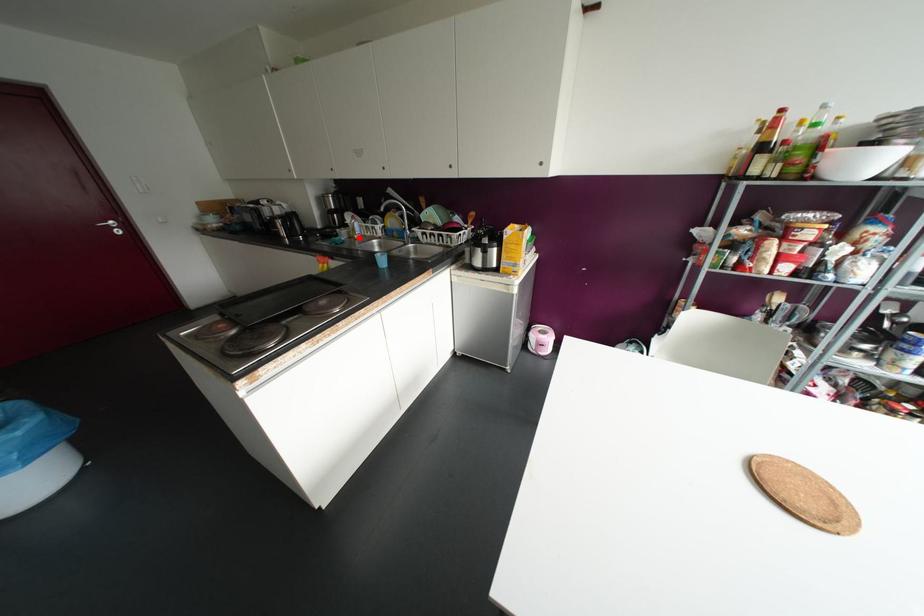
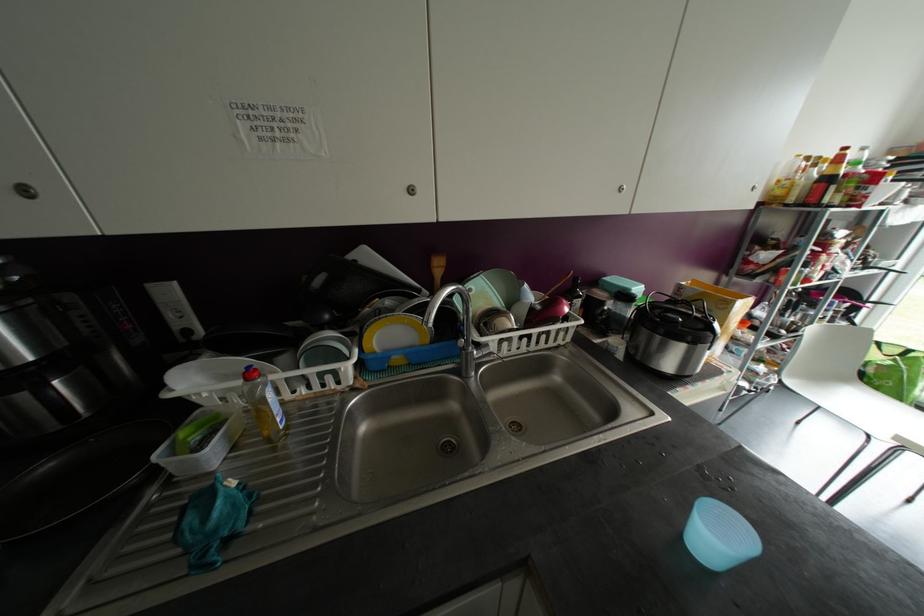
Question: I am providing you with two images of the same scene from different viewpoints. Given a red point in image1, look at the same physical point in image2. Is it:

Choices:
 (A) Closer to the viewpoint
 (B) Farther from the viewpoint

Answer: (A)